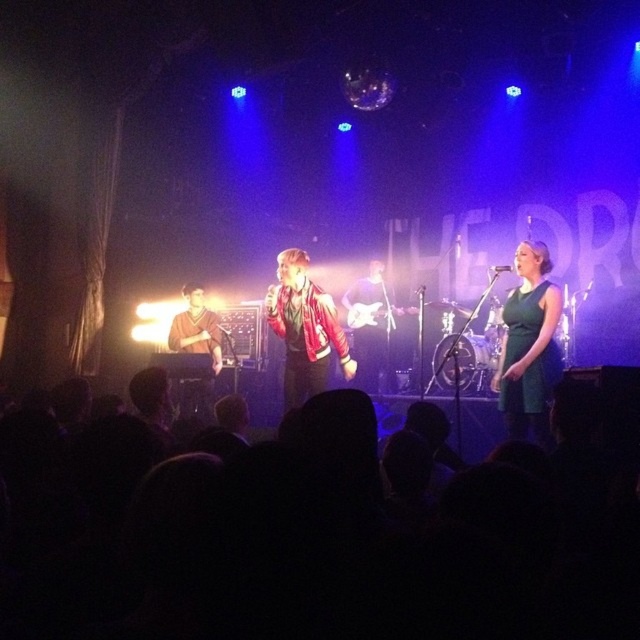
How far apart are shiny red jacket at center and reddish-brown leather jacket at center?

The distance of shiny red jacket at center from reddish-brown leather jacket at center is 2.38 meters.

Does shiny red jacket at center come behind reddish-brown leather jacket at center?

No, shiny red jacket at center is closer to the viewer.

Is point (292, 300) farther from camera compared to point (369, 380)?

No, (292, 300) is in front of (369, 380).

Image resolution: width=640 pixels, height=640 pixels. I want to click on shiny red jacket at center, so click(305, 330).

Is green satin dress at center to the left of brown leather jacket at left from the viewer's perspective?

Incorrect, green satin dress at center is not on the left side of brown leather jacket at left.

Between point (516, 292) and point (182, 396), which one is positioned in front?

Point (516, 292) is in front.

This screenshot has width=640, height=640. In order to click on green satin dress at center in this screenshot , I will do 529,346.

Which is below, shiny red jacket at center or brown leather jacket at left?

brown leather jacket at left

Who is more distant from viewer, (285, 394) or (168, 339)?

Positioned behind is point (168, 339).

Locate an element on the screen. The height and width of the screenshot is (640, 640). shiny red jacket at center is located at coordinates (305, 330).